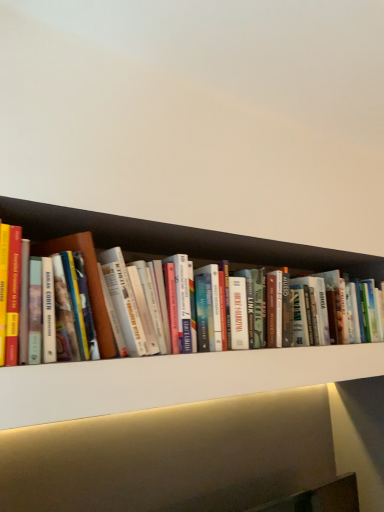
Find the location of a particular element. hardcover books at center is located at coordinates (13, 292).

This screenshot has width=384, height=512. What do you see at coordinates (13, 292) in the screenshot?
I see `hardcover books at center` at bounding box center [13, 292].

What are the coordinates of `hardcover books at center` in the screenshot? It's located at (13, 292).